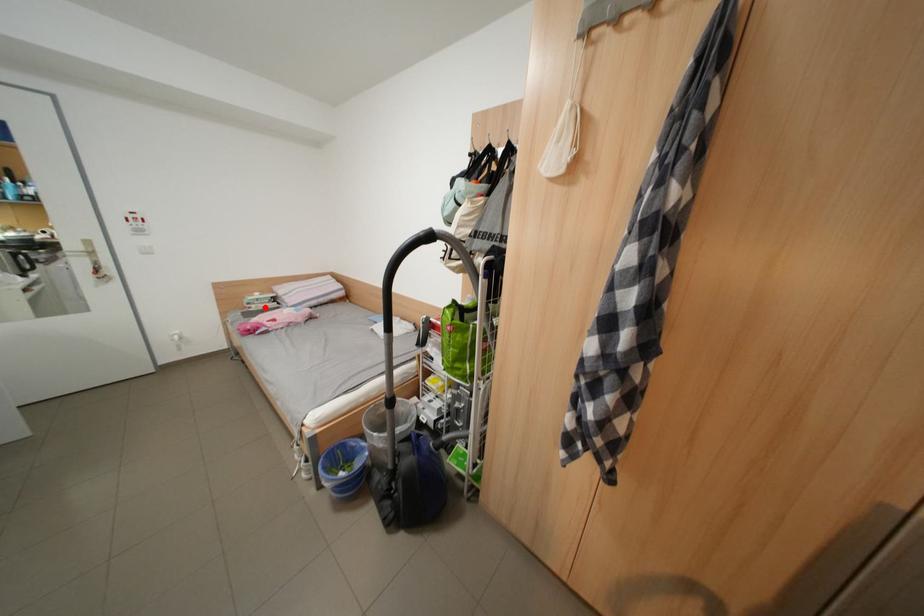
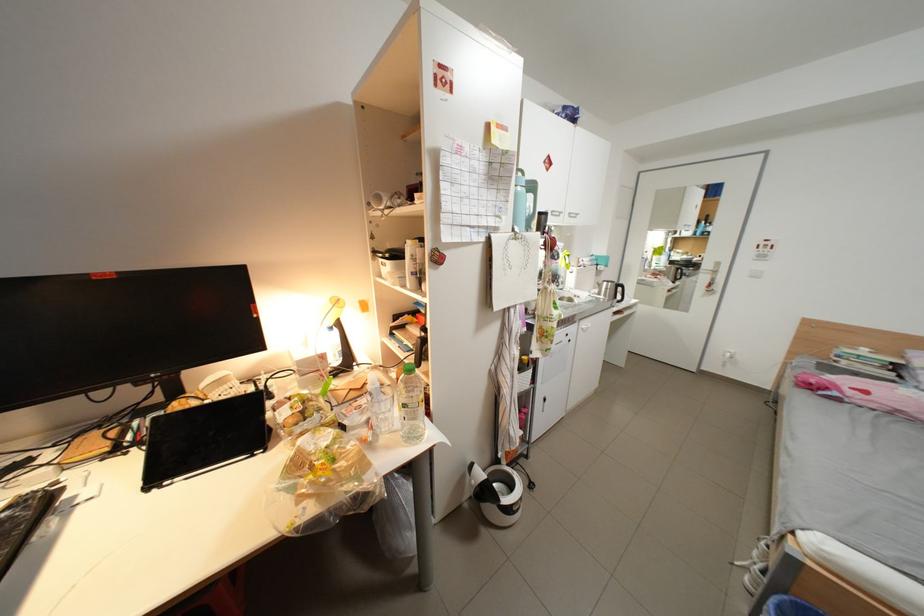
Where in the second image is the point corresponding to the highlighted location from the first image?

(856, 363)